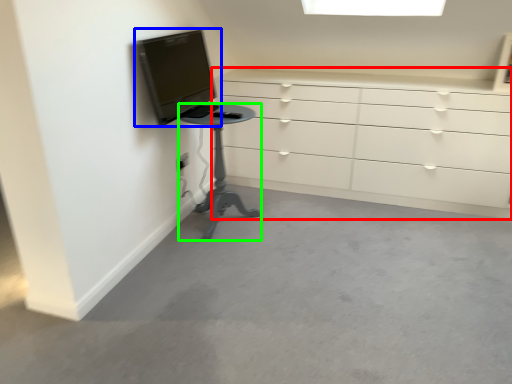
Question: Which object is the closest to the chest of drawers (highlighted by a red box)? Choose among these: television (highlighted by a blue box) or furniture (highlighted by a green box).

Choices:
 (A) television
 (B) furniture

Answer: (B)